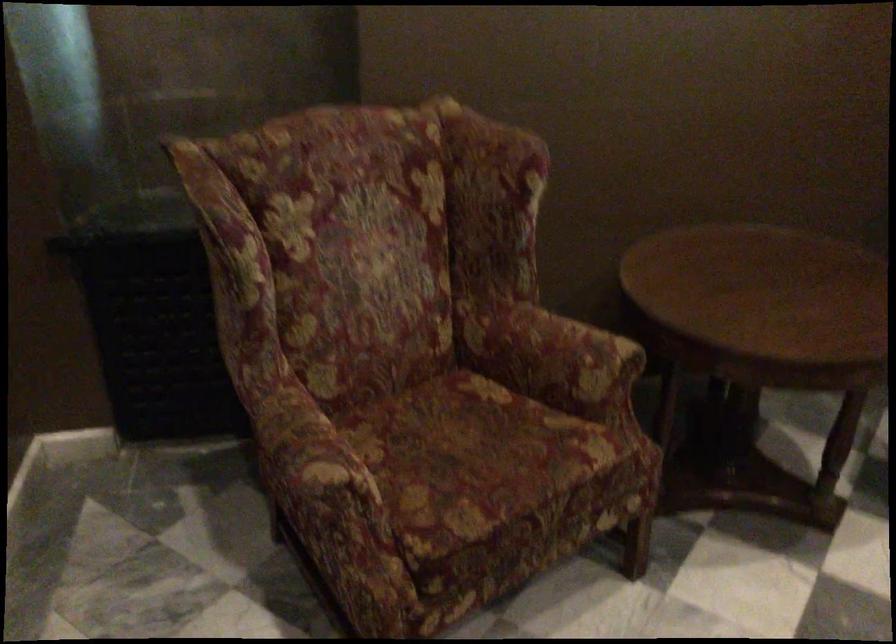
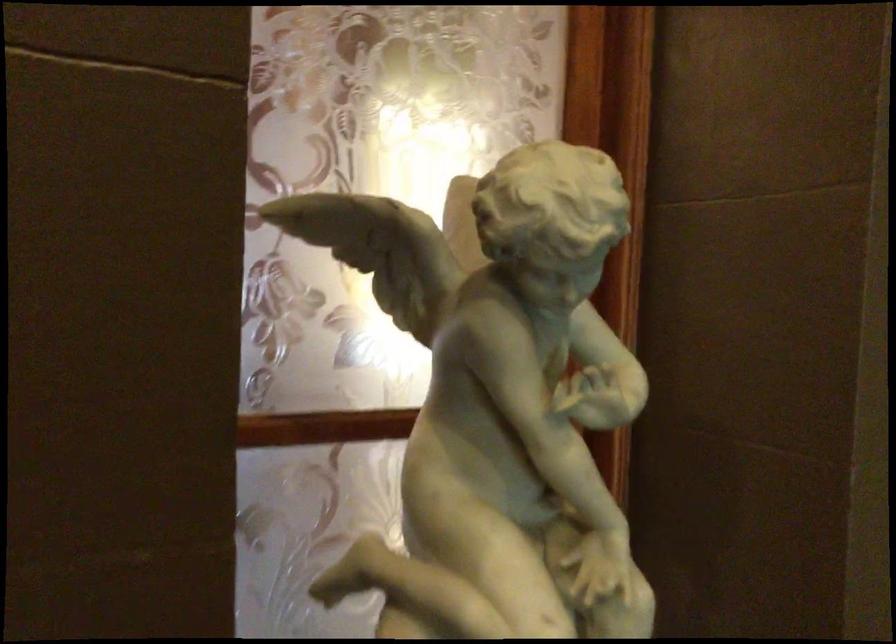
Question: The images are taken continuously from a first-person perspective. In which direction is your viewpoint rotating?

Choices:
 (A) Left
 (B) Right
 (C) Up
 (D) Down

Answer: (A)